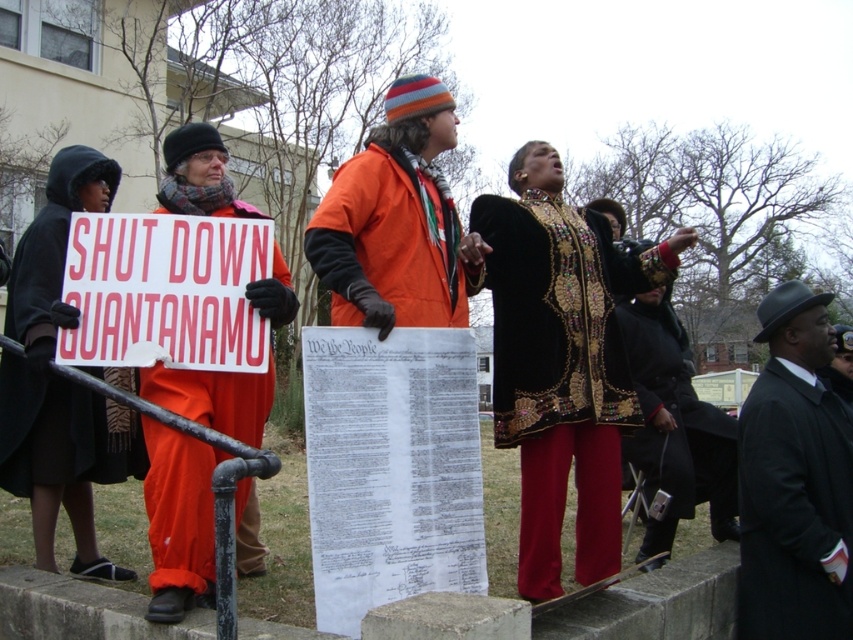
Question: Which of the following is the farthest from the observer?

Choices:
 (A) black wool hat at upper right
 (B) black velvet robe at center
 (C) orange fabric sign at left
 (D) black velvet coat at center

Answer: (D)

Question: Which of these objects is positioned closest to the orange fleece vest at center?

Choices:
 (A) black velvet coat at center
 (B) white paper sign at left
 (C) orange fabric sign at left
 (D) black wool hat at upper right

Answer: (B)

Question: From the image, what is the correct spatial relationship of black matte robe at left in relation to black velvet coat at center?

Choices:
 (A) below
 (B) above

Answer: (B)

Question: Which object is closer to the camera taking this photo?

Choices:
 (A) black velvet coat at center
 (B) white paper sign at left

Answer: (B)

Question: Can you confirm if black velvet coat at center is positioned to the right of orange fabric sign at left?

Choices:
 (A) yes
 (B) no

Answer: (A)

Question: Is black wool hat at upper right above orange fleece vest at center?

Choices:
 (A) yes
 (B) no

Answer: (B)